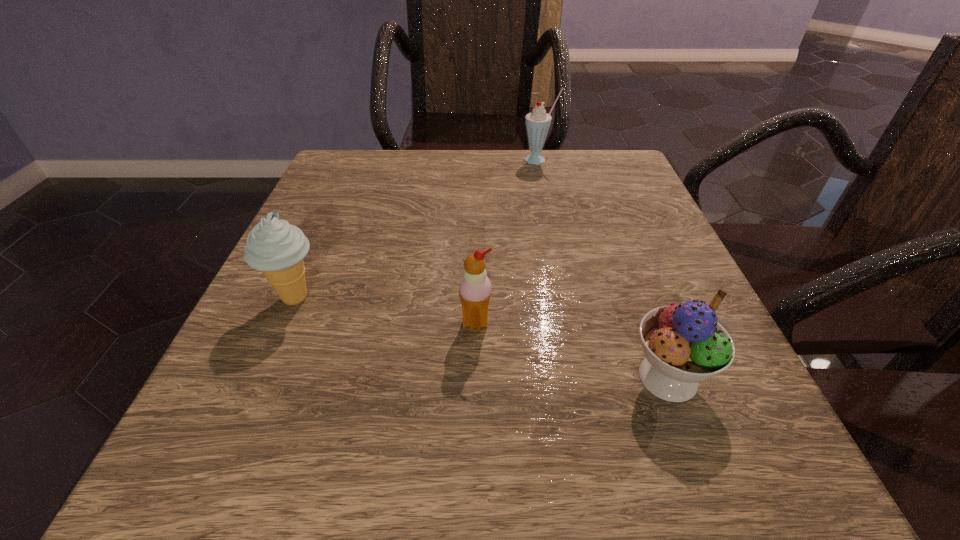
Locate which object is the closest to the second icecream from right to left. Please provide its 2D coordinates. Your answer should be formatted as a tuple, i.e. [(x, y)], where the tuple contains the x and y coordinates of a point satisfying the conditions above.

[(684, 344)]

Choose which object is the nearest neighbor to the nearest object. Please provide its 2D coordinates. Your answer should be formatted as a tuple, i.e. [(x, y)], where the tuple contains the x and y coordinates of a point satisfying the conditions above.

[(475, 287)]

Identify the location of icecream that is the closest to the rightmost object. (475, 287).

At what (x,y) coordinates should I click in order to perform the action: click on the third closest icecream to the second object from right to left. Please return your answer as a coordinate pair (x, y). The height and width of the screenshot is (540, 960). Looking at the image, I should click on click(x=684, y=344).

You are a GUI agent. You are given a task and a screenshot of the screen. Output one action in this format:
    pyautogui.click(x=<x>, y=<y>)
    Task: Click on the free space that satisfies the following two spatial constraints: 1. on the front side of the nearest icecream; 2. on the right side of the leftmost object
    The width and height of the screenshot is (960, 540).
    Given the screenshot: What is the action you would take?
    pyautogui.click(x=261, y=377)

You are a GUI agent. You are given a task and a screenshot of the screen. Output one action in this format:
    pyautogui.click(x=<x>, y=<y>)
    Task: Click on the free space that satisfies the following two spatial constraints: 1. at the front with a straw on the third object from right to left; 2. on the left side of the rightmost object
    
    Given the screenshot: What is the action you would take?
    pyautogui.click(x=475, y=377)

Identify the location of free space that satisfies the following two spatial constraints: 1. on the straw side of the second object from right to left; 2. on the left side of the nearest icecream. point(586,377).

I want to click on vacant space that satisfies the following two spatial constraints: 1. on the straw side of the nearest object; 2. on the left side of the farthest object, so click(x=586, y=377).